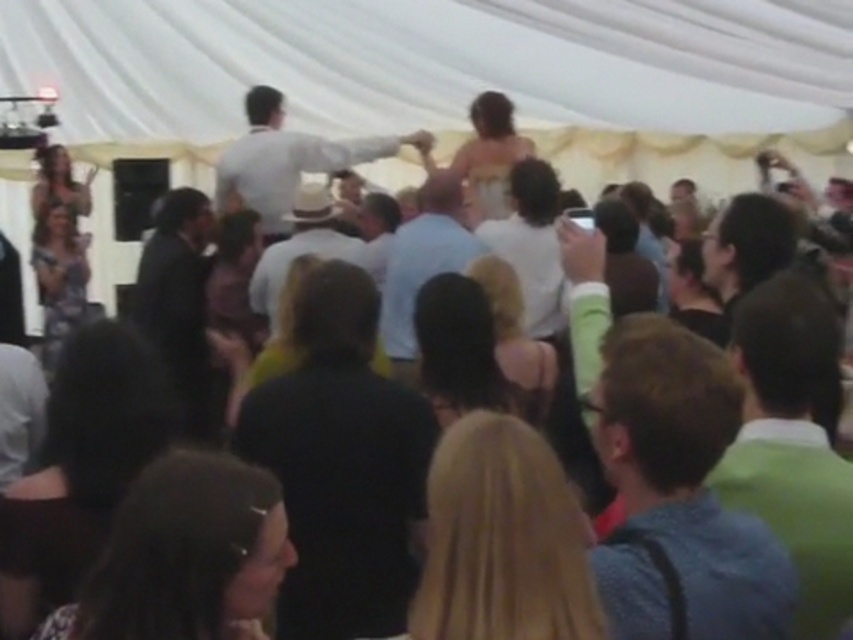
Can you confirm if black matte shirt at center is wider than white shirt at center?

No.

How much distance is there between black matte shirt at center and white shirt at center?

They are 5.44 meters apart.

Locate an element on the screen. The width and height of the screenshot is (853, 640). black matte shirt at center is located at coordinates (341, 465).

Locate an element on the screen. Image resolution: width=853 pixels, height=640 pixels. black matte shirt at center is located at coordinates (341, 465).

Does blue denim shirt at center have a greater height compared to green fabric shirt at right?

No, blue denim shirt at center is not taller than green fabric shirt at right.

Looking at this image, between blue denim shirt at center and green fabric shirt at right, which one is positioned lower?

Positioned lower is blue denim shirt at center.

Which is behind, point (692, 333) or point (764, 506)?

Positioned behind is point (764, 506).

The image size is (853, 640). Find the location of `blue denim shirt at center`. blue denim shirt at center is located at coordinates (680, 493).

Does green fabric shirt at right appear over light brown straw hat at center?

Incorrect, green fabric shirt at right is not positioned above light brown straw hat at center.

Who is positioned more to the right, green fabric shirt at right or light brown straw hat at center?

green fabric shirt at right is more to the right.

Does point (746, 476) come in front of point (260, 310)?

Yes, it is in front of point (260, 310).

At what (x,y) coordinates should I click in order to perform the action: click on green fabric shirt at right. Please return your answer as a coordinate pair (x, y). Image resolution: width=853 pixels, height=640 pixels. Looking at the image, I should click on (791, 444).